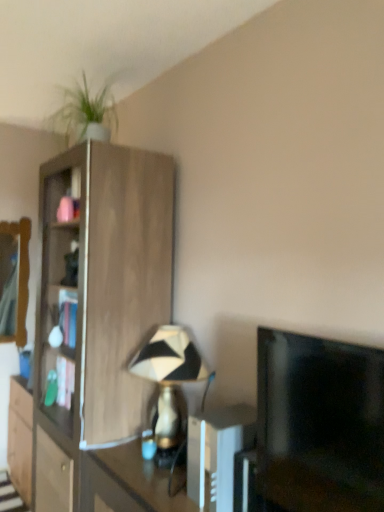
Question: From a real-world perspective, is black glossy tv at right physically located above or below wooden mirror at left?

Choices:
 (A) below
 (B) above

Answer: (A)

Question: Does point (382, 482) appear closer or farther from the camera than point (18, 222)?

Choices:
 (A) farther
 (B) closer

Answer: (B)

Question: Which object is the closest to the white plastic remote control at center?

Choices:
 (A) wooden cabinet at left
 (B) black and white geometric lampshade at center
 (C) black glossy tv at right
 (D) wooden mirror at left

Answer: (C)

Question: Which of these objects is positioned closest to the black and white geometric lampshade at center?

Choices:
 (A) wooden mirror at left
 (B) wooden cabinet at left
 (C) white plastic remote control at center
 (D) black glossy tv at right

Answer: (C)